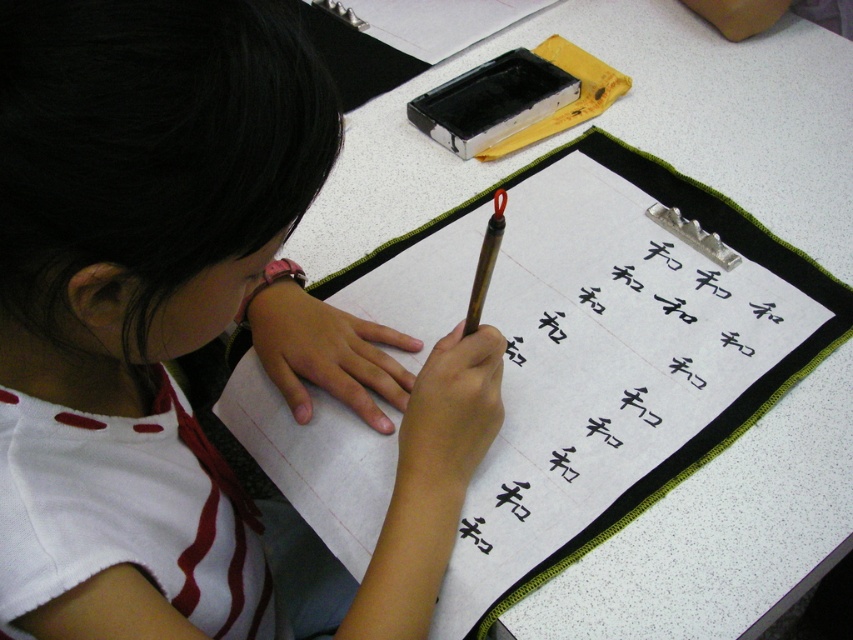
Is black fabric clipboard at center to the right of brown wooden pencil at center from the viewer's perspective?

Indeed, black fabric clipboard at center is positioned on the right side of brown wooden pencil at center.

Does black fabric clipboard at center have a lesser width compared to brown wooden pencil at center?

In fact, black fabric clipboard at center might be wider than brown wooden pencil at center.

In order to click on black fabric clipboard at center in this screenshot , I will do `click(619, 360)`.

Locate an element on the screen. black fabric clipboard at center is located at coordinates (619, 360).

Between white fabric shirt at center and brown wooden pencil at center, which one has more height?

With more height is white fabric shirt at center.

Can you confirm if white fabric shirt at center is smaller than brown wooden pencil at center?

No.

Between point (364, 394) and point (488, 248), which one is positioned in front?

Point (488, 248) is in front.

The height and width of the screenshot is (640, 853). I want to click on white fabric shirt at center, so click(189, 333).

Can you confirm if white fabric shirt at center is smaller than black fabric clipboard at center?

Yes.

Who is more forward, (0, 289) or (496, 573)?

Point (0, 289) is in front.

Locate an element on the screen. The width and height of the screenshot is (853, 640). white fabric shirt at center is located at coordinates (189, 333).